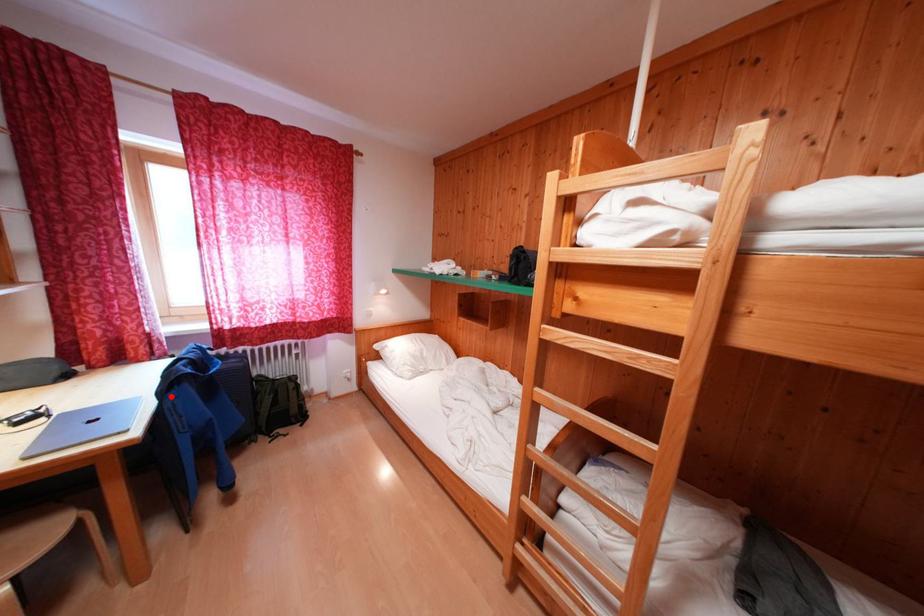
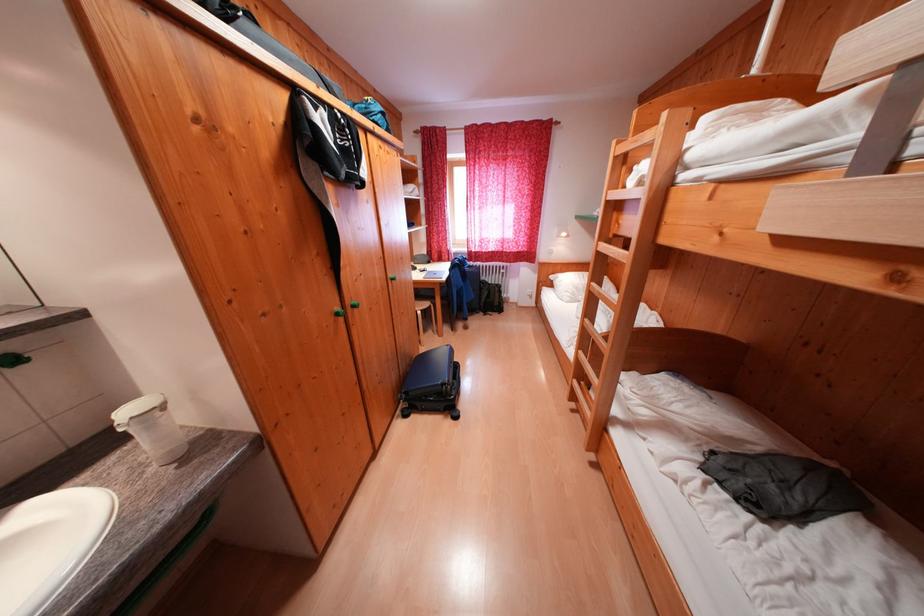
The point at the highlighted location is marked in the first image. Where is the corresponding point in the second image?

(458, 274)